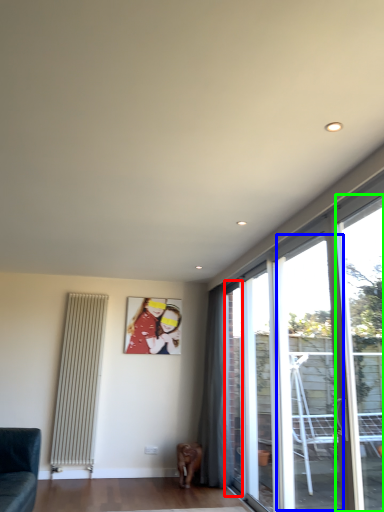
Question: Based on their relative distances, which object is nearer to window (highlighted by a red box)? Choose from window (highlighted by a blue box) and window (highlighted by a green box).

Choices:
 (A) window
 (B) window

Answer: (A)